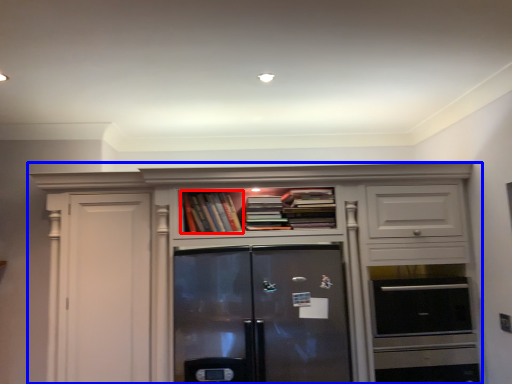
Question: Which object appears farthest to the camera in this image, book (highlighted by a red box) or cabinetry (highlighted by a blue box)?

Choices:
 (A) book
 (B) cabinetry

Answer: (A)